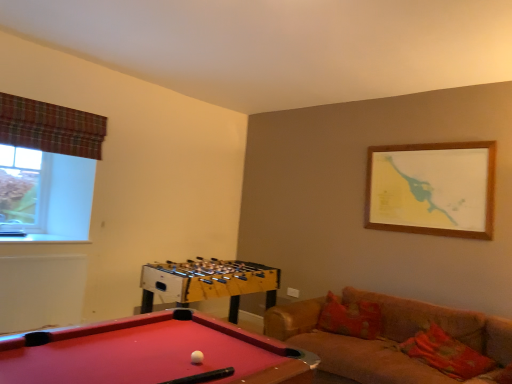
Question: Is white matte ball at center bigger or smaller than clear glass window at upper left?

Choices:
 (A) small
 (B) big

Answer: (A)

Question: Relative to clear glass window at upper left, is white matte ball at center in front or behind?

Choices:
 (A) front
 (B) behind

Answer: (A)

Question: Estimate the real-world distances between objects in this image. Which object is closer to the plaid fabric curtain at upper left?

Choices:
 (A) smooth red pool table at lower left
 (B) clear glass window at upper left
 (C) velvet brown couch at lower right
 (D) white matte ball at center
 (E) floral fabric pillow at lower right

Answer: (B)

Question: Which is farther from the velvet brown couch at lower right?

Choices:
 (A) smooth red pool table at lower left
 (B) floral fabric pillow at lower right
 (C) clear glass window at upper left
 (D) white matte ball at center
 (E) plaid fabric curtain at upper left

Answer: (C)